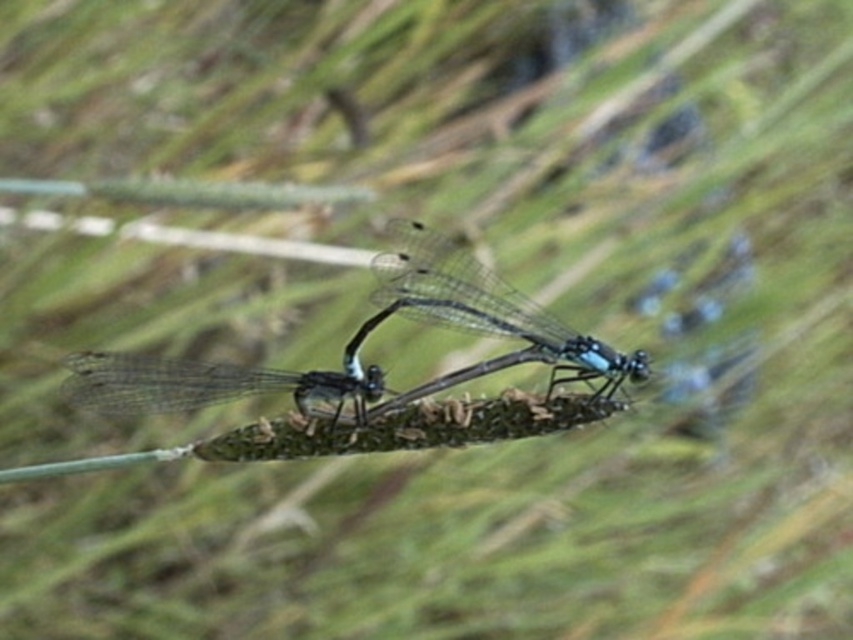
Who is taller, translucent glass dragonfly at center or transparent glass dragonfly at center?

With more height is translucent glass dragonfly at center.

Based on the photo, is translucent glass dragonfly at center positioned at the back of transparent glass dragonfly at center?

That is True.

Consider the image. Who is more forward, (427, 272) or (200, 365)?

Point (200, 365) is more forward.

You are a GUI agent. You are given a task and a screenshot of the screen. Output one action in this format:
    pyautogui.click(x=<x>, y=<y>)
    Task: Click on the translucent glass dragonfly at center
    This screenshot has width=853, height=640.
    Given the screenshot: What is the action you would take?
    pyautogui.click(x=485, y=316)